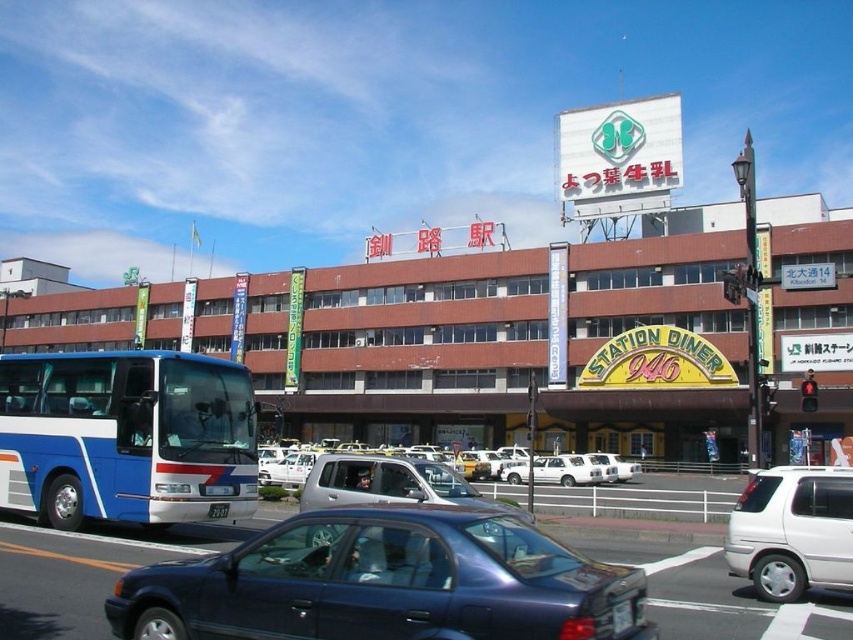
Consider the image. Who is higher up, metallic blue sedan at center or blue metallic bus at left?

Positioned higher is blue metallic bus at left.

Between point (506, 516) and point (161, 403), which one is positioned in front?

Point (506, 516) is more forward.

I want to click on metallic blue sedan at center, so click(x=381, y=582).

Can you confirm if blue metallic bus at left is smaller than white plastic license plate at center?

Incorrect, blue metallic bus at left is not smaller in size than white plastic license plate at center.

Is blue metallic bus at left wider than white plastic license plate at center?

Yes.

Who is more distant from viewer, (114, 381) or (207, 516)?

The point (114, 381) is more distant.

Find the location of `blue metallic bus at left`. blue metallic bus at left is located at coordinates (125, 436).

Can you confirm if white matte van at lower right is positioned above white plastic license plate at center?

No, white matte van at lower right is not above white plastic license plate at center.

Does point (785, 596) come farther from viewer compared to point (227, 508)?

No, (785, 596) is closer to viewer.

Where is `white matte van at lower right`? white matte van at lower right is located at coordinates (792, 531).